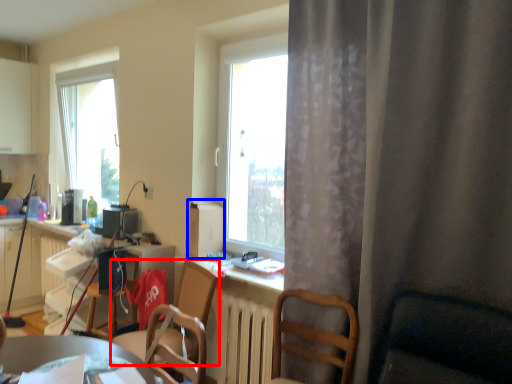
Question: Which object is further to the camera taking this photo, chair (highlighted by a red box) or appliance (highlighted by a blue box)?

Choices:
 (A) chair
 (B) appliance

Answer: (B)